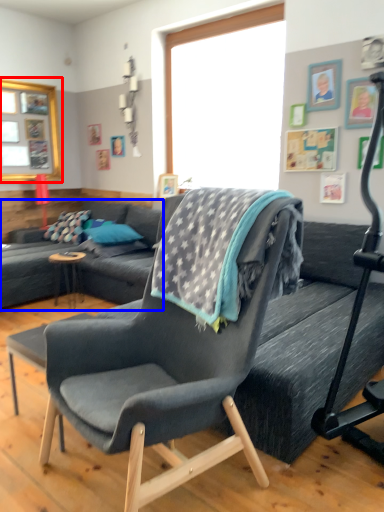
Question: Among these objects, which one is farthest to the camera, window screen (highlighted by a red box) or studio couch (highlighted by a blue box)?

Choices:
 (A) window screen
 (B) studio couch

Answer: (A)